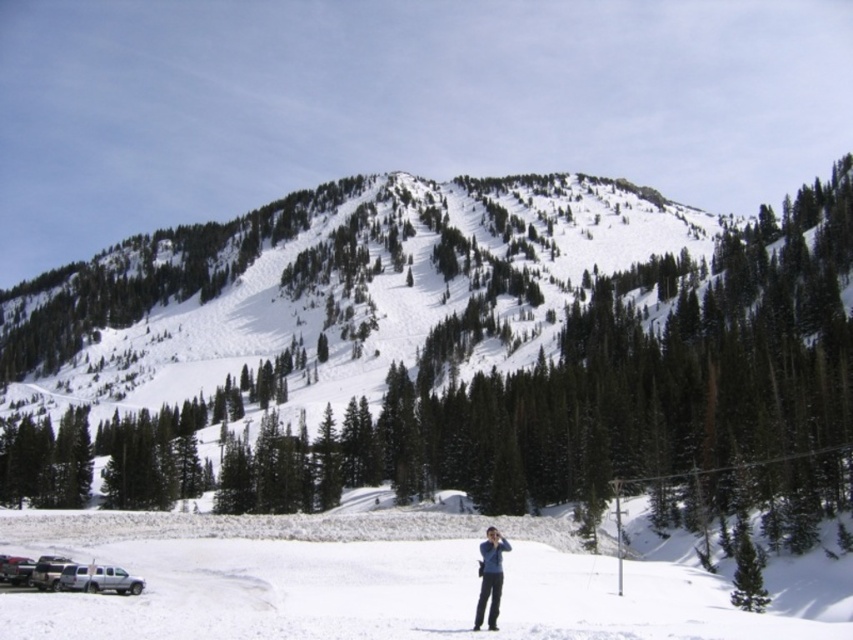
You are planning to ski down the white snow ski slope at lower center. You notice the blue fabric jacket at lower center is in your path. Is the jacket above or below the slope?

The white snow ski slope at lower center is below the blue fabric jacket at lower center, so the jacket is above the slope.

You are a drone operator trying to capture a photo of the white snow ski slope at lower center. The drone is currently at point 0.8, 0.4. Should you move the drone to the left or right to get a better shot?

The white snow ski slope at lower center is located at point (363, 580). The drone is at (340, 512). To center the shot, move the drone to the right since the slope is to the right of the current position.

You are standing at point (480,596) and want to walk towards the mountain. Will you pass through point (635,611)?

Point (635,611) is behind point (480,596), so if you walk towards the mountain from point (480,596), you will pass through point (635,611).